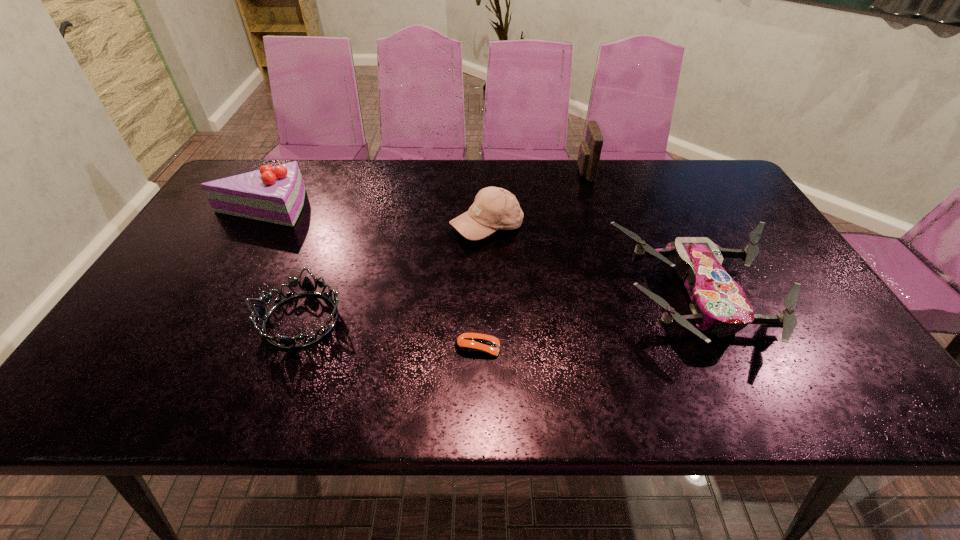
You are a GUI agent. You are given a task and a screenshot of the screen. Output one action in this format:
    pyautogui.click(x=<x>, y=<y>)
    Task: Click on the vacant region located 0.080m on the right of the leftmost object
    This screenshot has height=540, width=960.
    Given the screenshot: What is the action you would take?
    pyautogui.click(x=330, y=207)

The height and width of the screenshot is (540, 960). I want to click on vacant area situated 0.310m on the front-facing side of the baseball cap, so click(489, 340).

Locate an element on the screen. free space located 0.060m on the front-facing side of the drone is located at coordinates (745, 389).

At what (x,y) coordinates should I click in order to perform the action: click on blank space located on the right of the computer mouse. Please return your answer as a coordinate pair (x, y). Image resolution: width=960 pixels, height=540 pixels. Looking at the image, I should click on (551, 348).

Identify the location of pouch that is at the far edge. (589, 154).

Locate an element on the screen. This screenshot has height=540, width=960. cake located at the far edge is located at coordinates (276, 194).

Find the location of a particular element. object present at the left edge is located at coordinates (276, 194).

What are the coordinates of `object at the right edge` in the screenshot? It's located at (719, 306).

Image resolution: width=960 pixels, height=540 pixels. What are the coordinates of `object at the far left corner` in the screenshot? It's located at (276, 194).

Image resolution: width=960 pixels, height=540 pixels. What are the coordinates of `vacant space at the far edge of the desktop` in the screenshot? It's located at (381, 196).